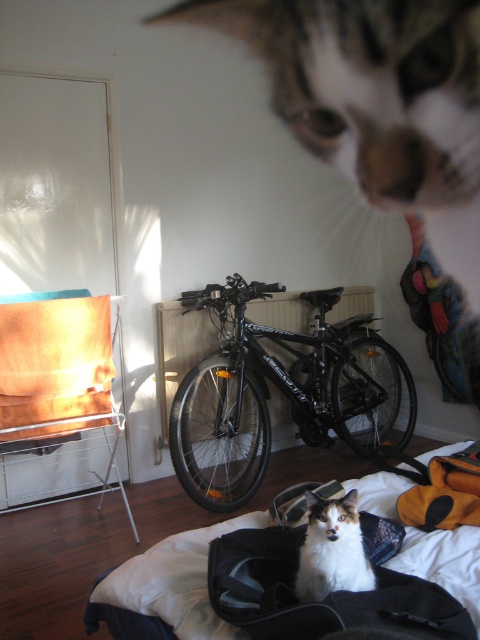
You are trying to move the soft black fabric bag at lower center to another location. Can you lift it without moving the black matte bicycle at center?

The black matte bicycle at center is positioned over soft black fabric bag at lower center, so you cannot lift the soft black fabric bag at lower center without moving the black matte bicycle at center first.

You are a person trying to move the black matte bicycle at center to the left side of the room. Can you move it without disturbing the white soft bed at center?

The black matte bicycle at center is positioned over white soft bed at center, so moving it might disturb the bed. You should check if the bed can be moved first or find another path.

You are organizing a small pet carrier for a calico fur cat at center. You have a soft black fabric bag at lower center. Can the cat fit into the bag?

The soft black fabric bag at lower center is larger in size than the calico fur cat at center, so the cat can fit into the bag.